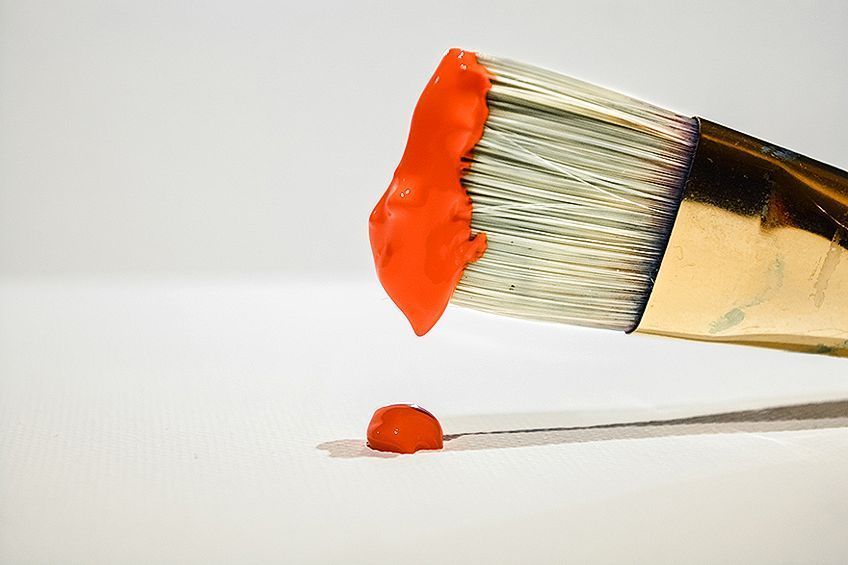
I want to click on metal part of brush that holds bristles, so click(751, 195).